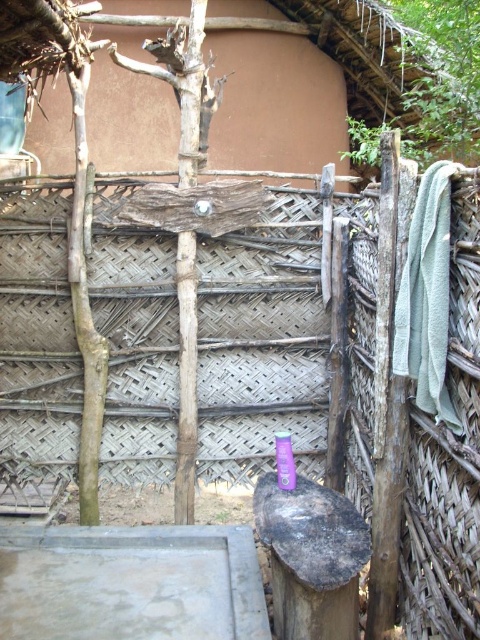
You are standing on the concrete platform in front of the wooden fence. You see a green terry towel at right and a purple plastic bottle at center. Which object is positioned farther to the right?

The green terry towel at right is positioned farther to the right than the purple plastic bottle at center.

You are standing in front of the wooden fence and want to grab the green terry towel at right. According to the coordinates provided, where exactly should you look to find it?

The green terry towel at right is located at point coordinates of (x=427, y=296).

You are organizing items on a concrete platform in front of a rustic wooden fence. You have a green terry towel at right and a purple plastic bottle at center. Which item takes up more space?

The green terry towel at right is larger in size than the purple plastic bottle at center, so it takes up more space.